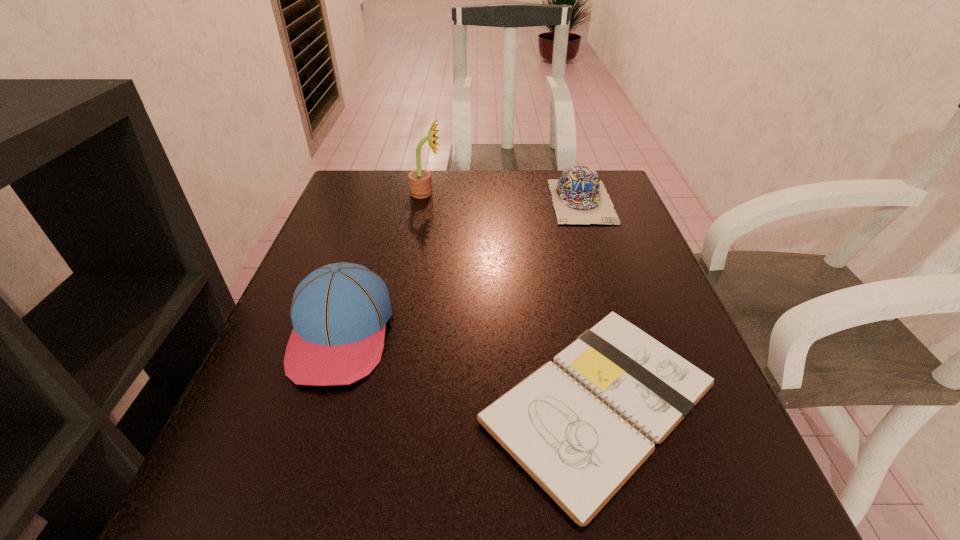
Where is `free space that satisfies the following two spatial constraints: 1. on the face of the tallest object; 2. on the front-facing side of the baseball cap`? free space that satisfies the following two spatial constraints: 1. on the face of the tallest object; 2. on the front-facing side of the baseball cap is located at coordinates (401, 333).